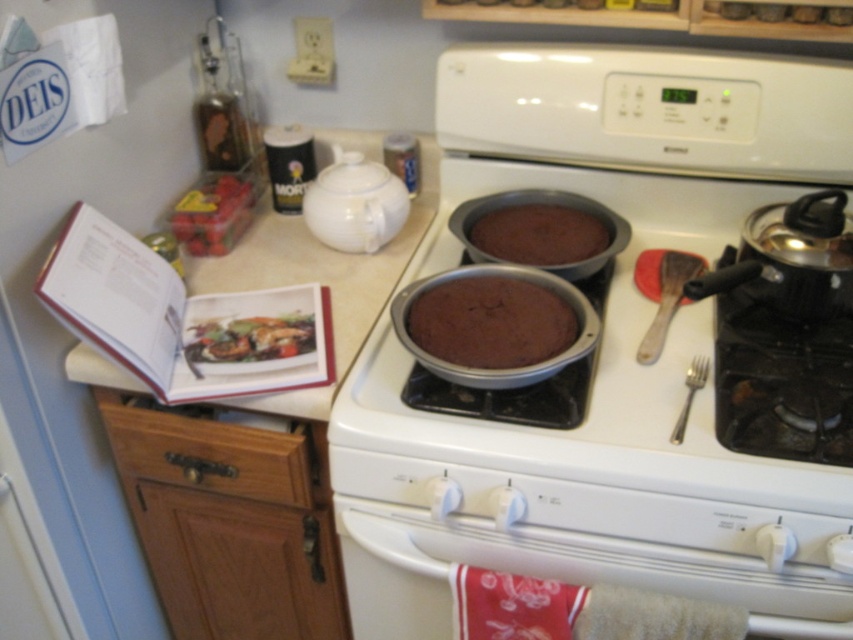
Question: Does chocolate matte pan at center have a larger size compared to shiny brown meat at center?

Choices:
 (A) yes
 (B) no

Answer: (A)

Question: Does matte silver stove top at center appear on the right side of wooden drawer at lower left?

Choices:
 (A) yes
 (B) no

Answer: (A)

Question: Which object appears closest to the camera in this image?

Choices:
 (A) matte silver stove top at center
 (B) chocolate matte pan at center
 (C) dark brown cake at center
 (D) satin silver fork at lower right

Answer: (A)

Question: Estimate the real-world distances between objects in this image. Which object is closer to the satin silver fork at lower right?

Choices:
 (A) shiny red berries at left
 (B) wooden drawer at lower left
 (C) shiny brown meat at center

Answer: (C)

Question: Is matte silver stove top at center closer to the viewer compared to shiny brown meat at center?

Choices:
 (A) yes
 (B) no

Answer: (A)

Question: Considering the real-world distances, which object is closest to the dark brown cake at center?

Choices:
 (A) wooden drawer at lower left
 (B) shiny brown meat at center
 (C) satin silver fork at lower right
 (D) shiny red berries at left

Answer: (C)